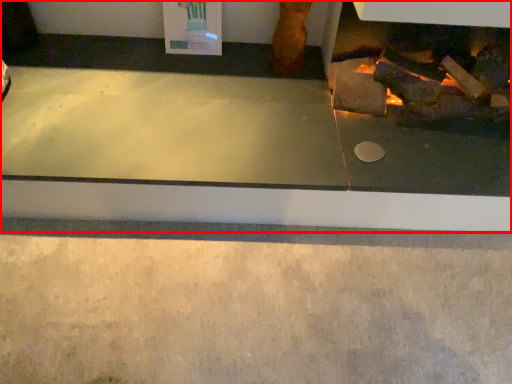
Question: From the image, what is the correct spatial relationship of fireplace (annotated by the red box) in relation to concrete?

Choices:
 (A) right
 (B) left

Answer: (B)